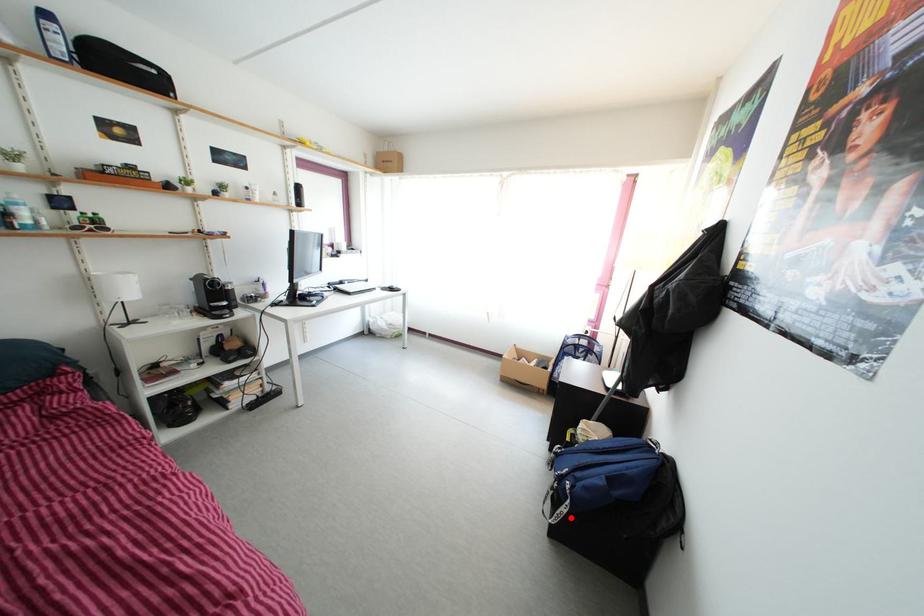
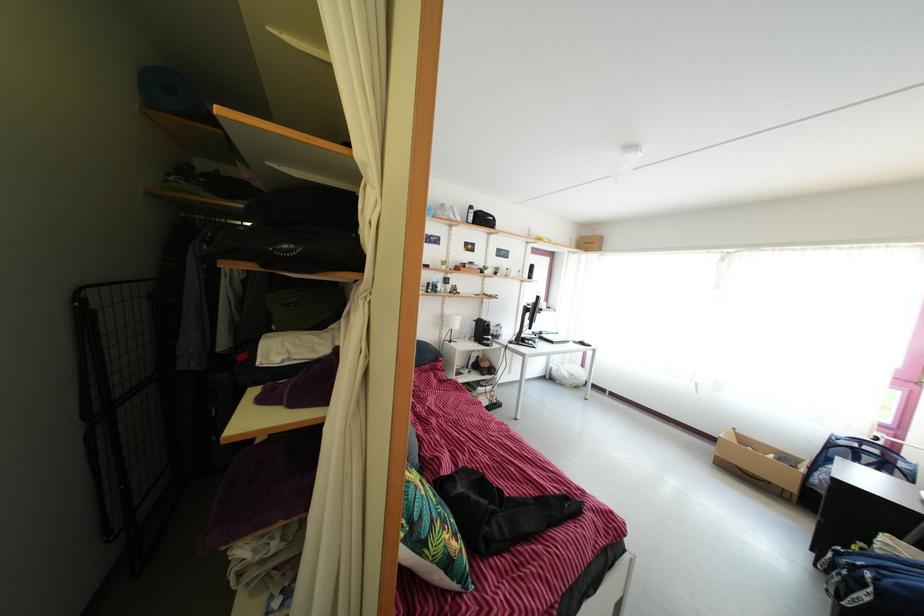
Find the pixel in the second image that matches the highlighted location in the first image.

(870, 605)